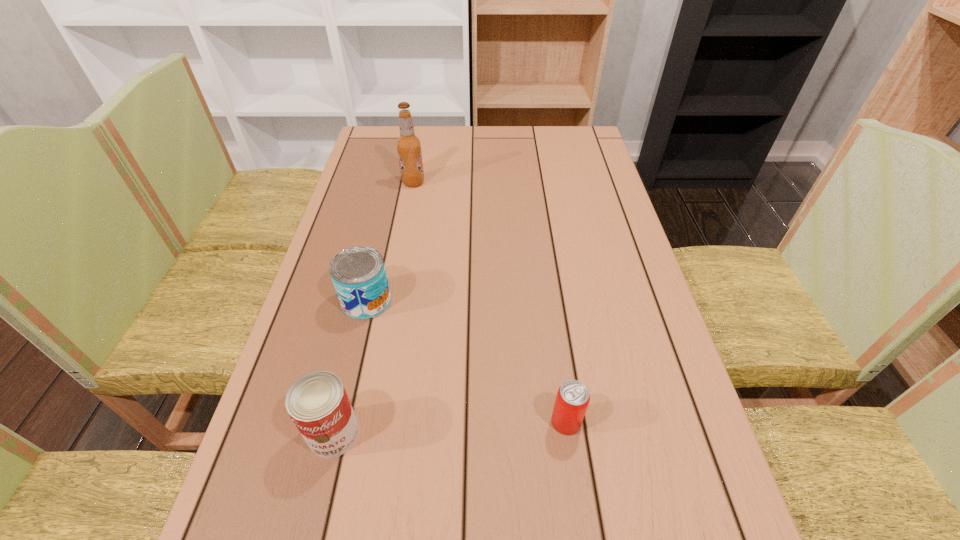
You are a GUI agent. You are given a task and a screenshot of the screen. Output one action in this format:
    pyautogui.click(x=<x>, y=<y>)
    Task: Click on the vacant region at the far left corner of the desktop
    
    Given the screenshot: What is the action you would take?
    pyautogui.click(x=366, y=158)

You are a GUI agent. You are given a task and a screenshot of the screen. Output one action in this format:
    pyautogui.click(x=<x>, y=<y>)
    Task: Click on the free space at the far right corner of the desktop
    The height and width of the screenshot is (540, 960).
    Given the screenshot: What is the action you would take?
    pyautogui.click(x=577, y=130)

Where is `empty space between the rightmost object and the farthest object`? The image size is (960, 540). empty space between the rightmost object and the farthest object is located at coordinates (490, 302).

You are a GUI agent. You are given a task and a screenshot of the screen. Output one action in this format:
    pyautogui.click(x=<x>, y=<y>)
    Task: Click on the vacant area that lies between the rightmost object and the farthest can
    This screenshot has width=960, height=540.
    Given the screenshot: What is the action you would take?
    pyautogui.click(x=467, y=361)

You are a GUI agent. You are given a task and a screenshot of the screen. Output one action in this format:
    pyautogui.click(x=<x>, y=<y>)
    Task: Click on the free space between the farthest can and the rightmost object
    This screenshot has width=960, height=540.
    Given the screenshot: What is the action you would take?
    pyautogui.click(x=467, y=361)

In order to click on free space between the rightmost object and the beer bottle in this screenshot , I will do `click(490, 302)`.

Identify which object is located as the second nearest to the farthest can. Please provide its 2D coordinates. Your answer should be formatted as a tuple, i.e. [(x, y)], where the tuple contains the x and y coordinates of a point satisfying the conditions above.

[(408, 145)]

The width and height of the screenshot is (960, 540). Find the location of `object that stands as the third closest to the farthest can`. object that stands as the third closest to the farthest can is located at coordinates (572, 399).

Find the location of a particular element. Image resolution: width=960 pixels, height=540 pixels. can object that ranks as the closest to the third nearest object is located at coordinates (317, 402).

In order to click on can that is the third closest to the farthest object in this screenshot , I will do `click(572, 399)`.